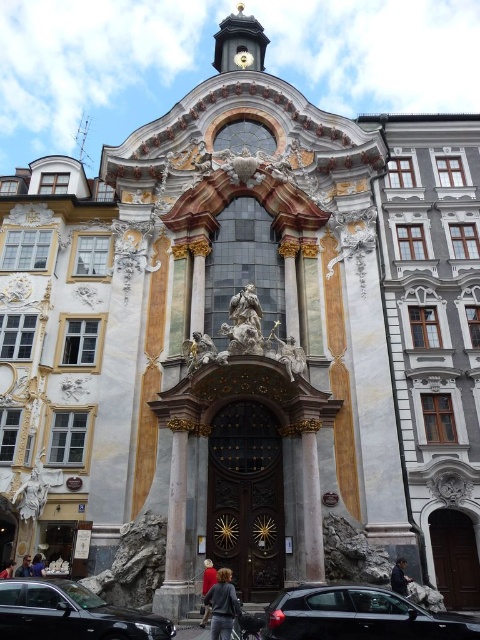
Question: Is dark wood door at center further to the viewer compared to red fabric at center?

Choices:
 (A) yes
 (B) no

Answer: (A)

Question: Which point appears closest to the camera in this image?

Choices:
 (A) (8, 618)
 (B) (207, 592)
 (C) (296, 627)

Answer: (C)

Question: Estimate the real-world distances between objects in this image. Which object is farther from the dark blue fabric at center?

Choices:
 (A) gray sweater at center
 (B) dark brown wooden door at center
 (C) dark gray jacket at lower left

Answer: (C)

Question: Is dark wood door at center further to camera compared to shiny black car at lower left?

Choices:
 (A) no
 (B) yes

Answer: (B)

Question: In this image, where is dark brown wooden door at center located relative to dark blue fabric at lower left?

Choices:
 (A) left
 (B) right

Answer: (B)

Question: Which of these objects is positioned farthest from the red fabric at center?

Choices:
 (A) dark blue fabric at center
 (B) dark blue fabric at lower left
 (C) gray sweater at center

Answer: (A)